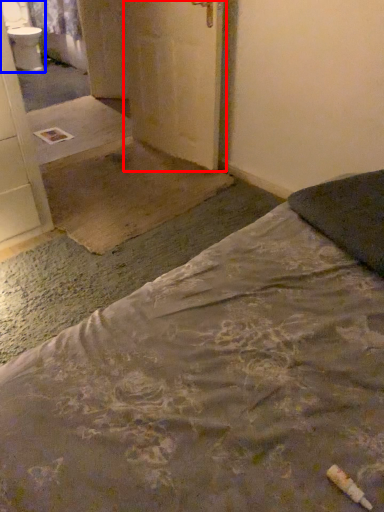
Question: Which object appears farthest to the camera in this image, door (highlighted by a red box) or sink (highlighted by a blue box)?

Choices:
 (A) door
 (B) sink

Answer: (B)